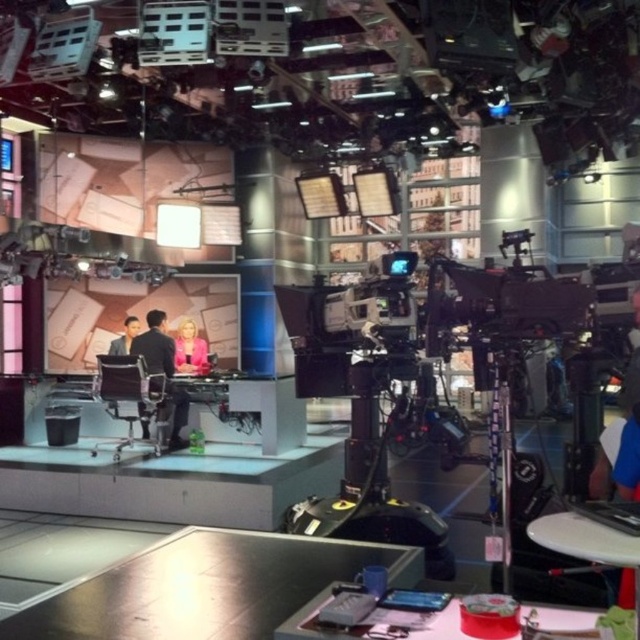
You are a costume designer preparing for a live show. You have two suits available in the studio control room. The dark suit at center and the matte black suit at left. Which suit is wider?

The dark suit at center is wider than the matte black suit at left.